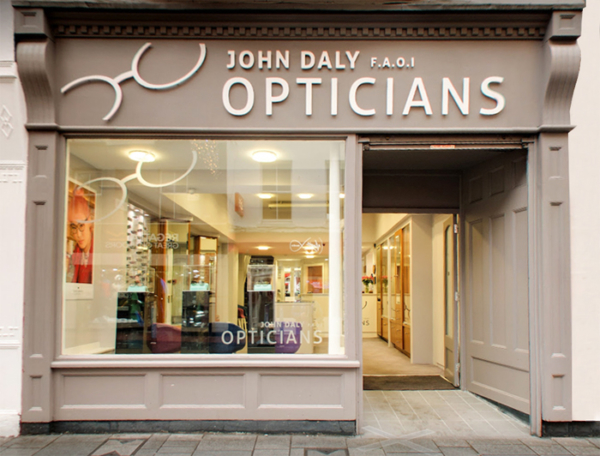
Locate an element on the screen. The image size is (600, 456). poster is located at coordinates [x=82, y=237].